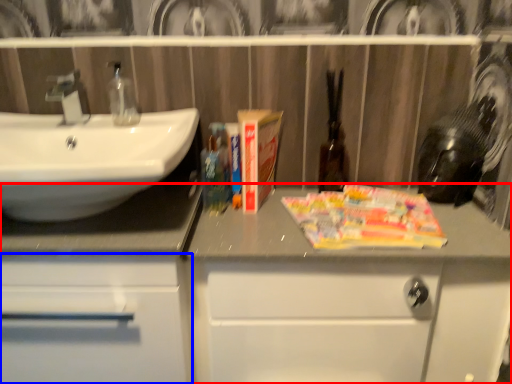
Question: Among these objects, which one is farthest to the camera, bathroom cabinet (highlighted by a red box) or bathroom cabinet (highlighted by a blue box)?

Choices:
 (A) bathroom cabinet
 (B) bathroom cabinet

Answer: (A)